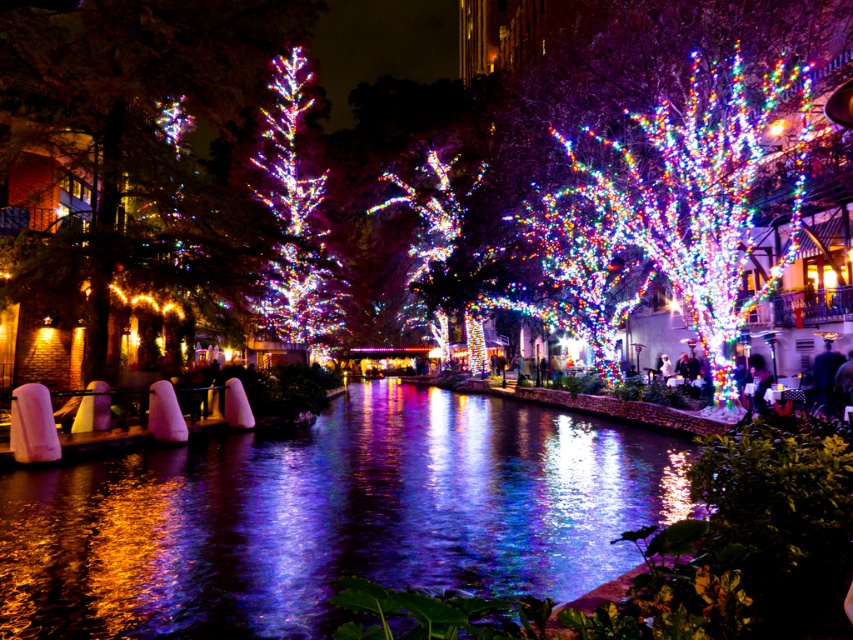
Question: Among these points, which one is farthest from the camera?

Choices:
 (A) (381, 563)
 (B) (728, 193)

Answer: (B)

Question: Is the position of glossy concrete river at center more distant than that of colorful lights at center?

Choices:
 (A) no
 (B) yes

Answer: (A)

Question: Is colorful lights at center smaller than iridescent glass tree at center?

Choices:
 (A) yes
 (B) no

Answer: (A)

Question: Does glossy concrete river at center appear over iridescent glass tree at center?

Choices:
 (A) no
 (B) yes

Answer: (A)

Question: Which object is positioned farthest from the iridescent glass tree at center?

Choices:
 (A) glossy concrete river at center
 (B) colorful lights at center

Answer: (B)

Question: Which point is farther from the camera taking this photo?

Choices:
 (A) (761, 109)
 (B) (308, 182)
 (C) (526, 410)

Answer: (B)